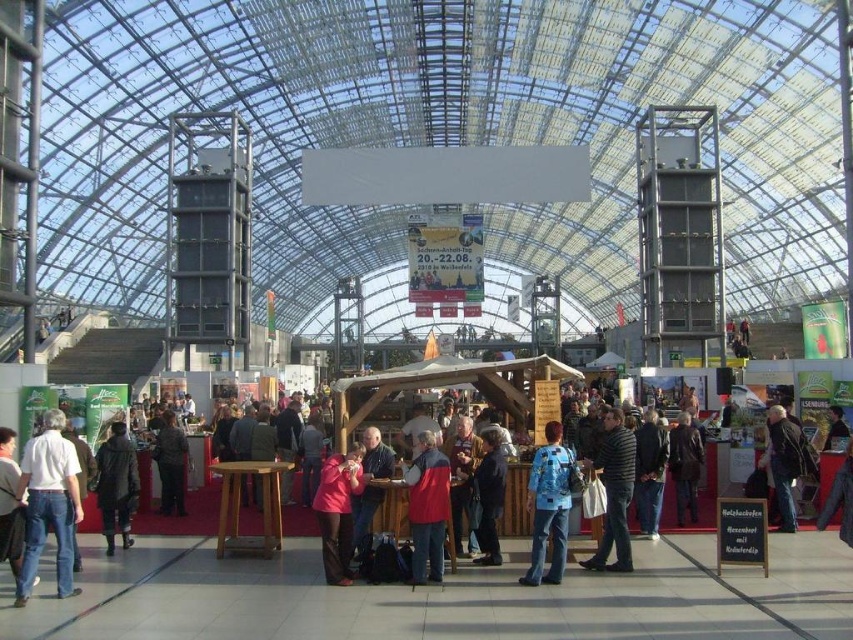
Question: Among these points, which one is farthest from the camera?

Choices:
 (A) (532, 515)
 (B) (341, 580)

Answer: (A)

Question: Is dark gray sweater at center bigger than dark brown leather jacket at center?

Choices:
 (A) yes
 (B) no

Answer: (B)

Question: Where is matte pink jacket at center located in relation to dark blue fabric jacket at center in the image?

Choices:
 (A) left
 (B) right

Answer: (A)

Question: Is black quilted jacket at lower left to the right of dark blue fabric jacket at center from the viewer's perspective?

Choices:
 (A) yes
 (B) no

Answer: (B)

Question: Which is nearer to the striped shirt at center?

Choices:
 (A) dark blue shirt at center
 (B) black quilted jacket at lower left

Answer: (A)

Question: Which of the following is the closest to the observer?

Choices:
 (A) blue denim jacket at center
 (B) dark gray textured coat at center
 (C) dark brown leather jacket at center

Answer: (A)